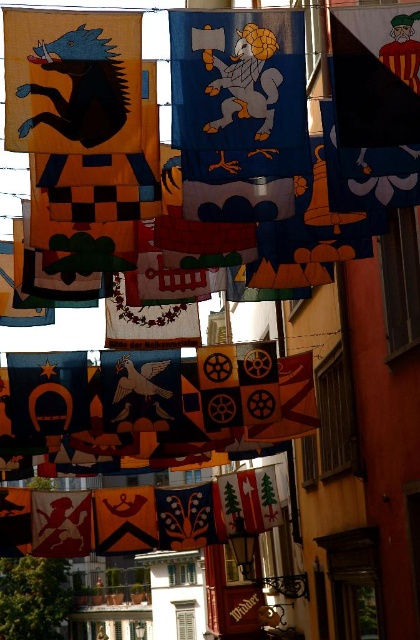
Question: Considering the relative positions of orange felt shield at center and silky blue fabric at center in the image provided, where is orange felt shield at center located with respect to silky blue fabric at center?

Choices:
 (A) right
 (B) left

Answer: (B)

Question: Estimate the real-world distances between objects in this image. Which object is closer to the orange felt shield at center?

Choices:
 (A) silky red cloth at lower left
 (B) silky blue fabric at center
 (C) silky orange flag at lower left
 (D) blue matte horseshoe at center

Answer: (A)

Question: Which object is farther from the camera taking this photo?

Choices:
 (A) blue matte horseshoe at center
 (B) orange felt shield at center
 (C) silky blue fabric at center

Answer: (C)

Question: In this image, where is silky blue fabric at center located relative to silky red cloth at lower left?

Choices:
 (A) below
 (B) above

Answer: (B)

Question: Based on their relative distances, which object is nearer to the silky red cloth at lower left?

Choices:
 (A) silky orange flag at lower left
 (B) orange felt shield at center
 (C) blue matte horseshoe at center
 (D) silky blue fabric at center

Answer: (A)

Question: Is silky blue fabric at center closer to the viewer compared to silky red cloth at lower left?

Choices:
 (A) no
 (B) yes

Answer: (A)